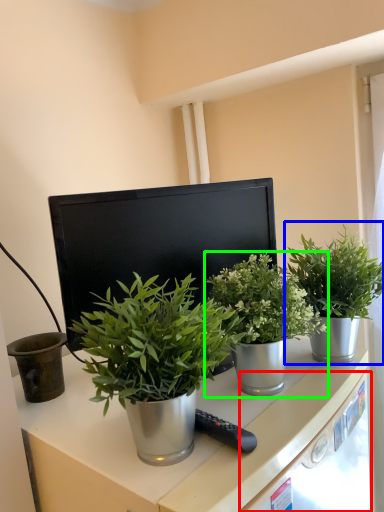
Question: Estimate the real-world distances between objects in this image. Which object is closer to drawer (highlighted by a red box), houseplant (highlighted by a blue box) or houseplant (highlighted by a green box)?

Choices:
 (A) houseplant
 (B) houseplant

Answer: (B)